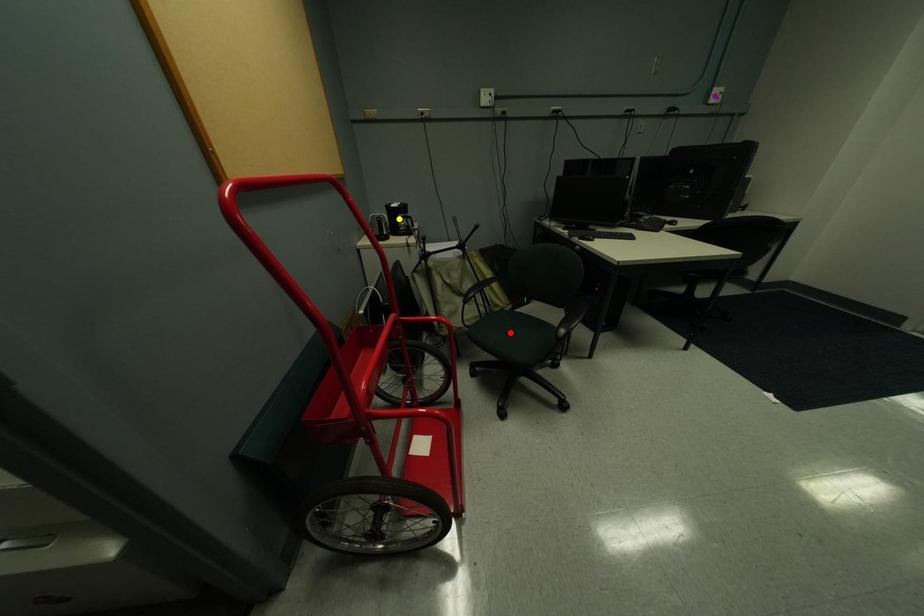
Order these from nearest to farthest:
red point | purple point | yellow point

1. red point
2. yellow point
3. purple point